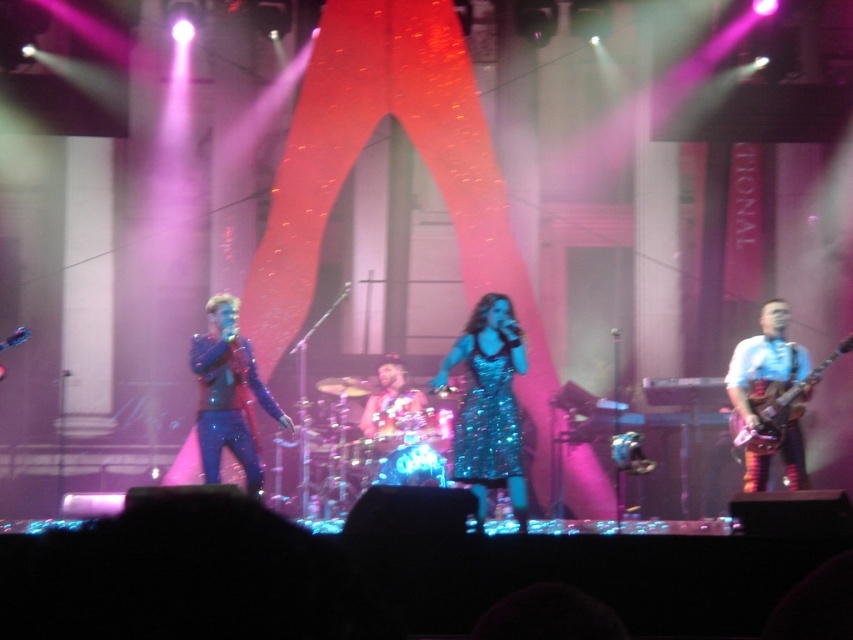
Looking at this image, who is taller, sparkly teal dress at center or shiny red guitar at right?

With more height is sparkly teal dress at center.

Is sparkly teal dress at center bigger than shiny red guitar at right?

Correct, sparkly teal dress at center is larger in size than shiny red guitar at right.

The width and height of the screenshot is (853, 640). Identify the location of sparkly teal dress at center. (488, 404).

Can you confirm if sparkly teal dress at center is shorter than sparkly blue jacket at center?

Incorrect, sparkly teal dress at center's height does not fall short of sparkly blue jacket at center's.

Does sparkly teal dress at center appear under sparkly blue jacket at center?

Correct, sparkly teal dress at center is located below sparkly blue jacket at center.

In order to click on sparkly teal dress at center in this screenshot , I will do tap(488, 404).

Does sparkly teal dress at center appear over shiny metallic drum set at center?

Yes.

Can you confirm if sparkly teal dress at center is positioned below shiny metallic drum set at center?

No.

You are a GUI agent. You are given a task and a screenshot of the screen. Output one action in this format:
    pyautogui.click(x=<x>, y=<y>)
    Task: Click on the sparkly teal dress at center
    
    Given the screenshot: What is the action you would take?
    pyautogui.click(x=488, y=404)